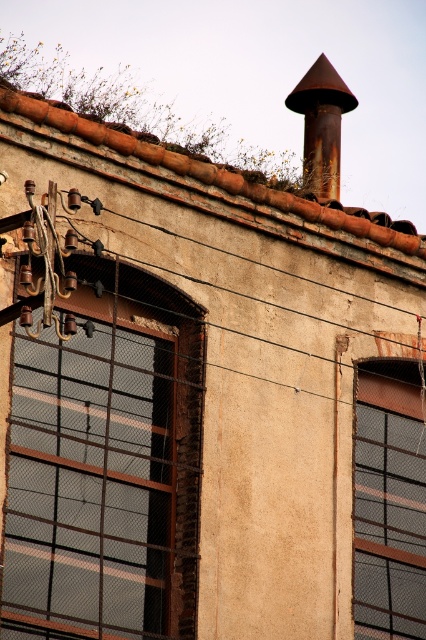
You are standing in front of an old building with an arched window. There is a point marked at coordinates point (101, 497). If you want to take a photo of this point from where you are standing, will the camera need to focus beyond 40 meters?

The point (101, 497) is 41.33 meters away from the camera, so yes, the camera will need to focus beyond 40 meters to capture it clearly.